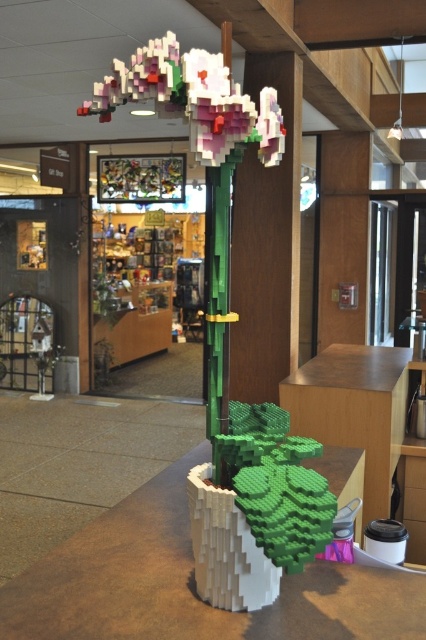
Is white matte table at center behind wooden table at center?

No, it is not.

Can you confirm if white matte table at center is taller than wooden table at center?

In fact, white matte table at center may be shorter than wooden table at center.

The height and width of the screenshot is (640, 426). What do you see at coordinates (190, 584) in the screenshot?
I see `white matte table at center` at bounding box center [190, 584].

This screenshot has height=640, width=426. What are the coordinates of `white matte table at center` in the screenshot? It's located at (190, 584).

Is point (164, 106) positioned in front of point (314, 408)?

Yes.

Does pastel plastic flowers at upper center have a lesser width compared to wooden table at center?

Indeed, pastel plastic flowers at upper center has a lesser width compared to wooden table at center.

Locate an element on the screen. pastel plastic flowers at upper center is located at coordinates tap(193, 99).

Between white matte table at center and pastel plastic flowers at upper center, which one is positioned lower?

white matte table at center is lower down.

Which is more to the right, white matte table at center or pastel plastic flowers at upper center?

From the viewer's perspective, pastel plastic flowers at upper center appears more on the right side.

Describe the element at coordinates (190, 584) in the screenshot. This screenshot has width=426, height=640. I see `white matte table at center` at that location.

At what (x,y) coordinates should I click in order to perform the action: click on white matte table at center. Please return your answer as a coordinate pair (x, y). Looking at the image, I should click on (190, 584).